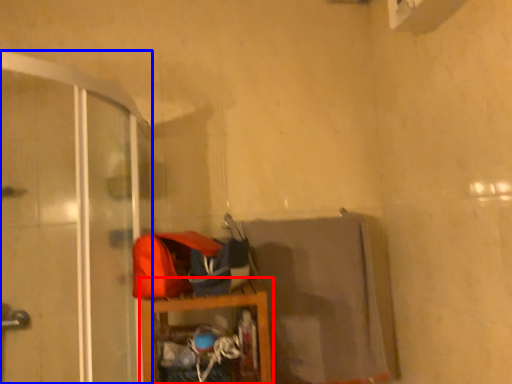
Question: Which point is closer to the camera, furniture (highlighted by a red box) or screen door (highlighted by a blue box)?

Choices:
 (A) furniture
 (B) screen door

Answer: (B)